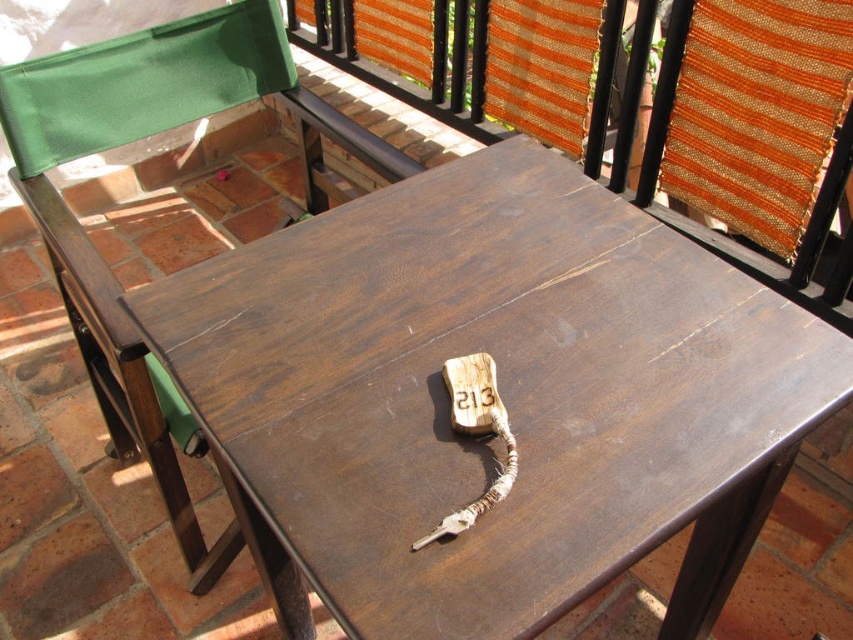
Question: Is dark wood keychain at center to the left of green fabric cushion at upper left from the viewer's perspective?

Choices:
 (A) no
 (B) yes

Answer: (A)

Question: Is dark wood keychain at center thinner than green fabric cushion at upper left?

Choices:
 (A) yes
 (B) no

Answer: (B)

Question: Which of the following is the closest to the observer?

Choices:
 (A) (543, 582)
 (B) (125, 96)

Answer: (A)

Question: Considering the relative positions of dark wood keychain at center and green fabric cushion at upper left in the image provided, where is dark wood keychain at center located with respect to green fabric cushion at upper left?

Choices:
 (A) right
 (B) left

Answer: (A)

Question: Which point appears closest to the camera in this image?

Choices:
 (A) pos(26,131)
 (B) pos(421,276)

Answer: (B)